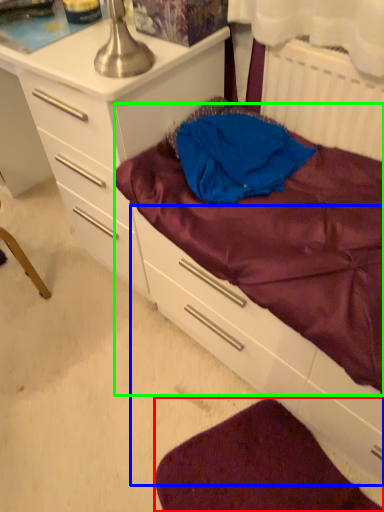
Question: Which object is the farthest from sheet (highlighted by a red box)? Choose among these: drawer (highlighted by a blue box) or mattress (highlighted by a green box).

Choices:
 (A) drawer
 (B) mattress

Answer: (B)